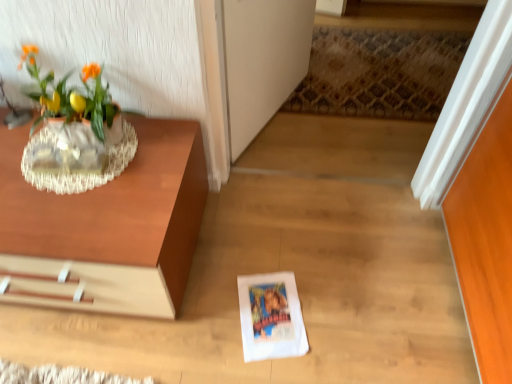
Image resolution: width=512 pixels, height=384 pixels. I want to click on white paper at center, so click(271, 317).

This screenshot has height=384, width=512. What do you see at coordinates (271, 317) in the screenshot?
I see `white paper at center` at bounding box center [271, 317].

Where is `transparent glass door at center`? transparent glass door at center is located at coordinates (262, 61).

This screenshot has width=512, height=384. Identify the location of matte glass vase at upper left. 73,120.

Where is `glass door directly beneath the clear glass vase at upper left (from a real-world perspective)`? glass door directly beneath the clear glass vase at upper left (from a real-world perspective) is located at coordinates (262, 61).

Would you say clear glass vase at upper left is outside transparent glass door at center?

clear glass vase at upper left is positioned outside transparent glass door at center.

Which is in front, clear glass vase at upper left or transparent glass door at center?

clear glass vase at upper left is in front.

Based on the photo, considering the sizes of objects clear glass vase at upper left and transparent glass door at center in the image provided, who is bigger, clear glass vase at upper left or transparent glass door at center?

Bigger between the two is transparent glass door at center.

Considering the relative sizes of transparent glass door at center and clear glass vase at upper left in the image provided, is transparent glass door at center smaller than clear glass vase at upper left?

No.

Can we say transparent glass door at center lies outside clear glass vase at upper left?

Yes, transparent glass door at center is outside of clear glass vase at upper left.

Considering the positions of objects transparent glass door at center and clear glass vase at upper left in the image provided, who is more to the left, transparent glass door at center or clear glass vase at upper left?

Positioned to the left is clear glass vase at upper left.

From a real-world perspective, between transparent glass door at center and clear glass vase at upper left, who is vertically lower?

transparent glass door at center.

Does white paper at center turn towards wooden table at left?

No, white paper at center is not turned towards wooden table at left.

Who is smaller, white paper at center or wooden table at left?

Smaller between the two is white paper at center.

From the picture: From a real-world perspective, is white paper at center physically above wooden table at left?

No, from a real-world perspective, white paper at center is not over wooden table at left

Is matte glass vase at upper left beside white paper at center?

No, matte glass vase at upper left is not touching white paper at center.

Which is in front, matte glass vase at upper left or white paper at center?

matte glass vase at upper left is more forward.

From a real-world perspective, which object stands above the other?

In real-world perspective, matte glass vase at upper left is above.

Does transparent glass door at center have a larger size compared to white paper at center?

Yes.

Is point (258, 110) in front of point (305, 350)?

No.

From the image's perspective, is transparent glass door at center over white paper at center?

Correct, transparent glass door at center appears higher than white paper at center in the image.

Is there a large distance between transparent glass door at center and white paper at center?

They are positioned close to each other.

Based on the photo, is white paper at center looking in the opposite direction of transparent glass door at center?

No, white paper at center is not facing the opposite direction of transparent glass door at center.

From a real-world perspective, between white paper at center and transparent glass door at center, who is vertically lower?

From a 3D spatial view, white paper at center is below.

Find the location of a particular element. Image resolution: width=512 pixels, height=384 pixels. paperback book lying behind the transparent glass door at center is located at coordinates (271, 317).

Considering the sizes of white paper at center and transparent glass door at center in the image, is white paper at center wider or thinner than transparent glass door at center?

Clearly, white paper at center has more width compared to transparent glass door at center.

Is matte glass vase at upper left not inside wooden table at left?

Yes, matte glass vase at upper left is outside of wooden table at left.

Between matte glass vase at upper left and wooden table at left, which one has larger width?

wooden table at left is wider.

From a real-world perspective, does matte glass vase at upper left sit lower than wooden table at left?

No.

Is matte glass vase at upper left at the right side of wooden table at left?

Yes, matte glass vase at upper left is to the right of wooden table at left.

Find the location of a particular element. This screenshot has width=512, height=384. vase on the left of transparent glass door at center is located at coordinates (80, 173).

At what (x,y) coordinates should I click in order to perform the action: click on vase in front of the transparent glass door at center. Please return your answer as a coordinate pair (x, y). This screenshot has width=512, height=384. Looking at the image, I should click on (80, 173).

Considering their positions, is matte glass vase at upper left positioned closer to clear glass vase at upper left than white paper at center?

matte glass vase at upper left lies closer to clear glass vase at upper left than the other object.

Considering their positions, is transparent glass door at center positioned further to white paper at center than wooden table at left?

transparent glass door at center is positioned further to the anchor white paper at center.

Based on their spatial positions, is wooden table at left or clear glass vase at upper left further from white paper at center?

clear glass vase at upper left is positioned further to the anchor white paper at center.

Based on their spatial positions, is wooden table at left or transparent glass door at center closer to matte glass vase at upper left?

wooden table at left is positioned closer to the anchor matte glass vase at upper left.

Looking at the image, which one is located further to white paper at center, wooden table at left or transparent glass door at center?

transparent glass door at center lies further to white paper at center than the other object.

In the scene shown: Estimate the real-world distances between objects in this image. Which object is further from clear glass vase at upper left, wooden table at left or white paper at center?

Among the two, white paper at center is located further to clear glass vase at upper left.

Based on their spatial positions, is matte glass vase at upper left or wooden table at left closer to transparent glass door at center?

wooden table at left lies closer to transparent glass door at center than the other object.

From the image, which object appears to be farther from white paper at center, matte glass vase at upper left or clear glass vase at upper left?

matte glass vase at upper left.

I want to click on vase between transparent glass door at center and white paper at center vertically, so click(x=80, y=173).

At what (x,y) coordinates should I click in order to perform the action: click on vase between matte glass vase at upper left and white paper at center vertically. Please return your answer as a coordinate pair (x, y). Looking at the image, I should click on (80, 173).

Image resolution: width=512 pixels, height=384 pixels. What are the coordinates of `vase situated between wooden table at left and transparent glass door at center from left to right` in the screenshot? It's located at (80, 173).

Locate an element on the screen. houseplant between wooden table at left and white paper at center is located at coordinates (73, 120).